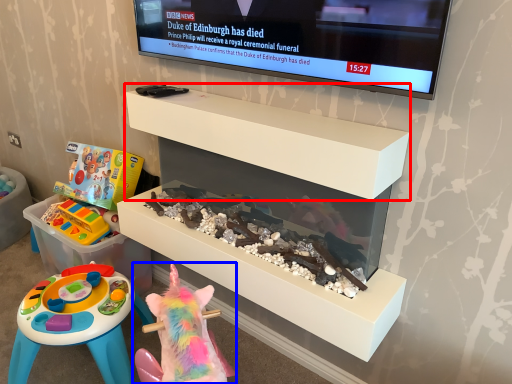
Question: Which object appears farthest to the camera in this image, shelf (highlighted by a red box) or toy (highlighted by a blue box)?

Choices:
 (A) shelf
 (B) toy

Answer: (A)